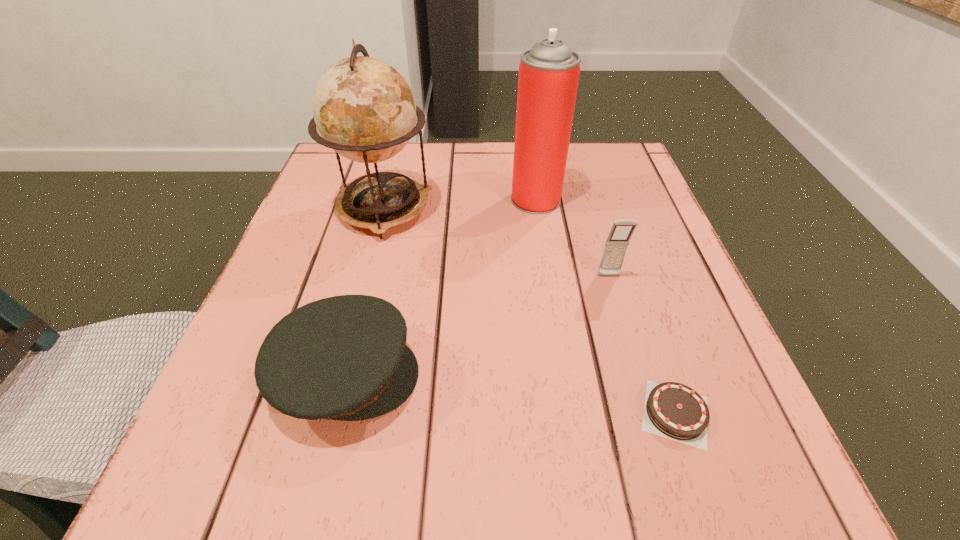
Locate an element on the screen. This screenshot has width=960, height=540. the third object from right to left is located at coordinates (549, 72).

Where is `globe`? globe is located at coordinates (365, 111).

The width and height of the screenshot is (960, 540). In order to click on the third farthest object in this screenshot , I will do `click(615, 248)`.

Locate an element on the screen. cellular telephone is located at coordinates (615, 248).

The width and height of the screenshot is (960, 540). I want to click on beret, so click(x=345, y=358).

The height and width of the screenshot is (540, 960). Find the location of `chocolate cake`. chocolate cake is located at coordinates (672, 410).

The image size is (960, 540). I want to click on blank area located 0.320m on the left of the aerosol can, so click(365, 199).

This screenshot has height=540, width=960. In order to click on free space located 0.130m at the center of the globe in this screenshot , I will do `click(362, 292)`.

Locate an element on the screen. vacant space located 0.060m on the front-facing side of the third nearest object is located at coordinates (617, 305).

Identify the location of vacant region located on the front-facing side of the fourth tallest object. This screenshot has height=540, width=960. (581, 375).